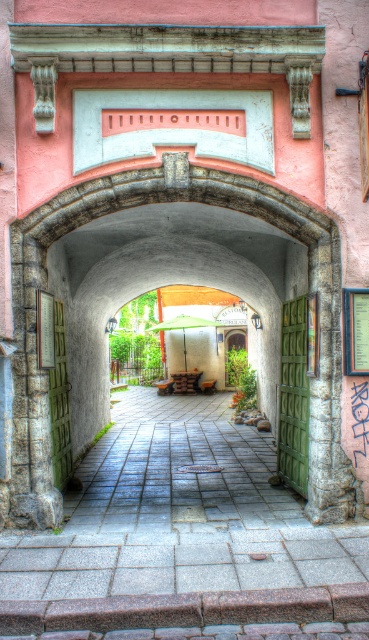
Does granite paved path at center have a larger size compared to green matte door at left?

Correct, granite paved path at center is larger in size than green matte door at left.

Who is more distant from viewer, [260,540] or [67,468]?

Point [67,468]

This screenshot has width=369, height=640. I want to click on granite paved path at center, so coord(184,540).

Is green wooden door at center shorter than green matte door at left?

No.

Is green wooden door at center further to camera compared to green matte door at left?

No.

Does point (294, 484) come behind point (57, 406)?

No, (294, 484) is closer to viewer.

The image size is (369, 640). Find the location of `green wooden door at center`. green wooden door at center is located at coordinates (294, 396).

Can you confirm if granite paved path at center is positioned above green wooden door at center?

Actually, granite paved path at center is below green wooden door at center.

Is granite paved path at center behind green wooden door at center?

No, granite paved path at center is closer to the viewer.

Does point (198, 524) come in front of point (281, 346)?

Yes, point (198, 524) is closer to viewer.

This screenshot has width=369, height=640. I want to click on granite paved path at center, so click(184, 540).